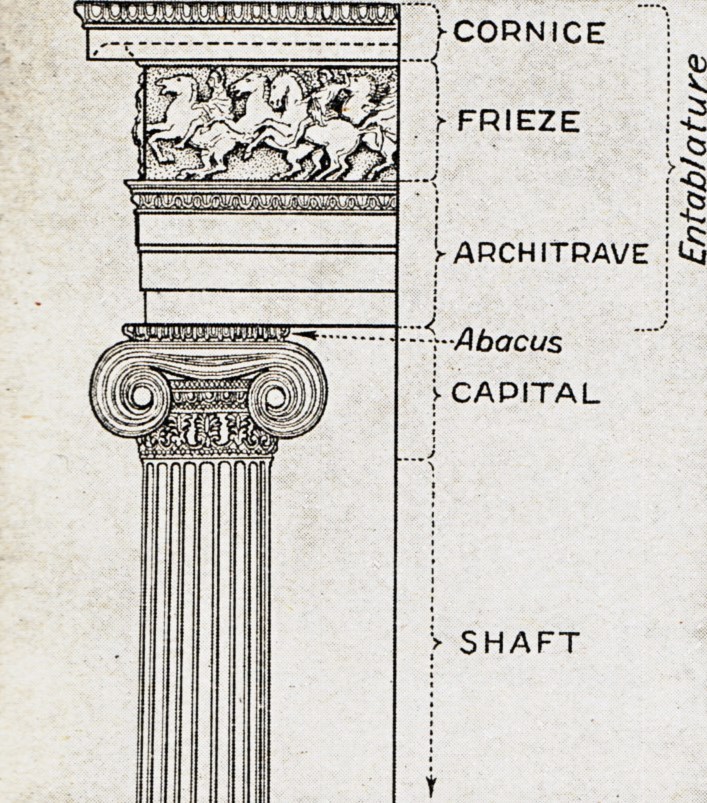
Find the location of a particular element. The width and height of the screenshot is (707, 803). cornice is located at coordinates (548, 38), (222, 35).